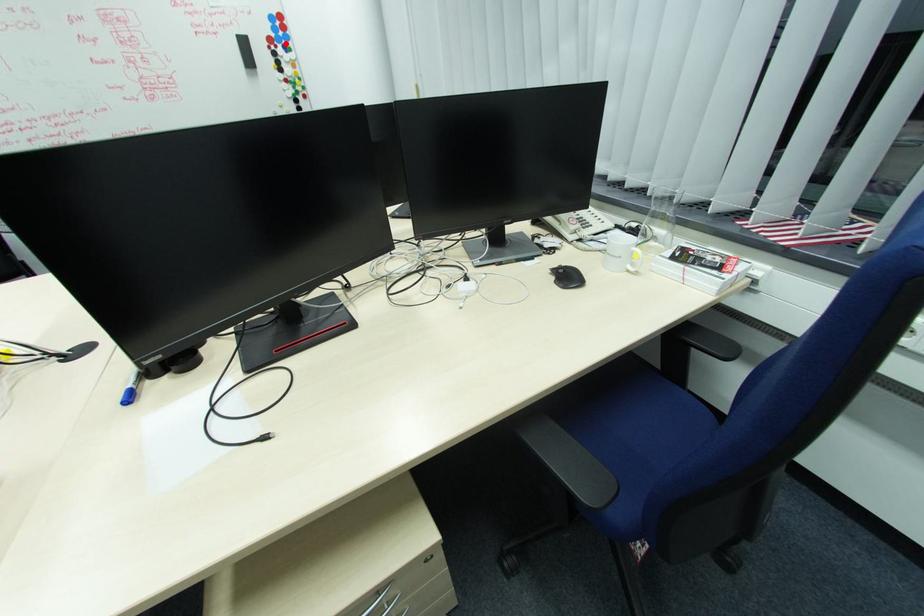
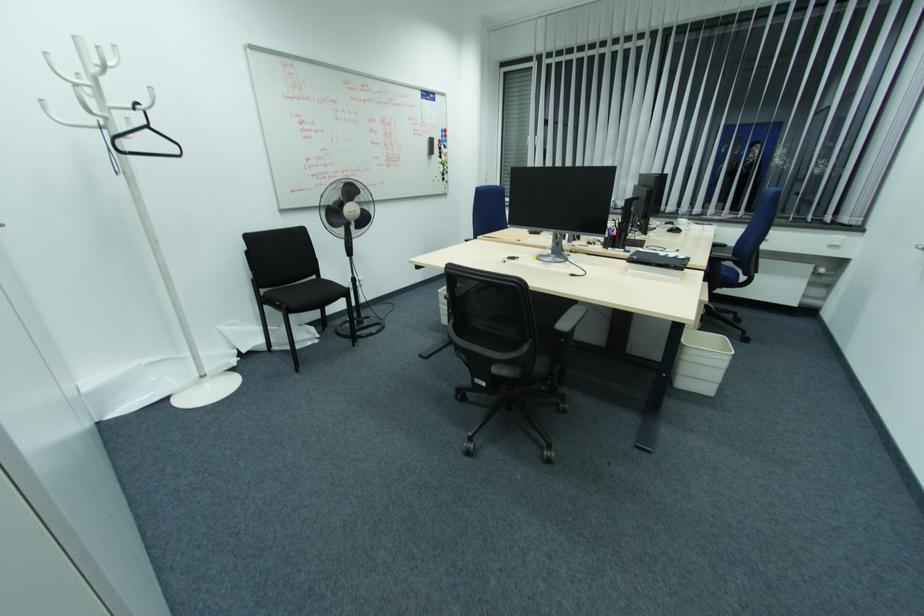
Question: I am providing you with two images of the same scene from different viewpoints. A red point is shown in image1. For the corresponding object point in image2, is it positioned nearer or farther from the camera?

Choices:
 (A) Nearer
 (B) Farther

Answer: (A)